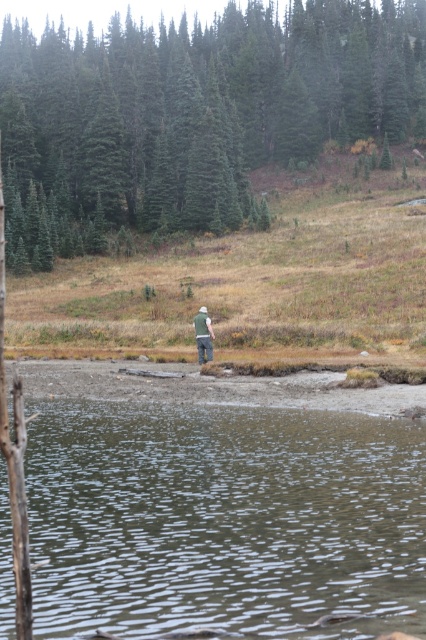
Question: Does green matte tree at upper center have a smaller size compared to camouflage fabric jacket at center?

Choices:
 (A) yes
 (B) no

Answer: (B)

Question: Which point is farther to the camera?

Choices:
 (A) camouflage fabric jacket at center
 (B) greenish-brown water at lower center
 (C) green matte tree at upper center

Answer: (C)

Question: Among these points, which one is farthest from the camera?

Choices:
 (A) (261, 624)
 (B) (199, 355)

Answer: (B)

Question: Can you confirm if greenish-brown water at lower center is thinner than camouflage fabric jacket at center?

Choices:
 (A) yes
 (B) no

Answer: (B)

Question: Can you confirm if greenish-brown water at lower center is positioned to the left of green matte tree at upper center?

Choices:
 (A) no
 (B) yes

Answer: (A)

Question: Which object is farther from the camera taking this photo?

Choices:
 (A) camouflage fabric jacket at center
 (B) green matte tree at upper center
 (C) greenish-brown water at lower center

Answer: (B)